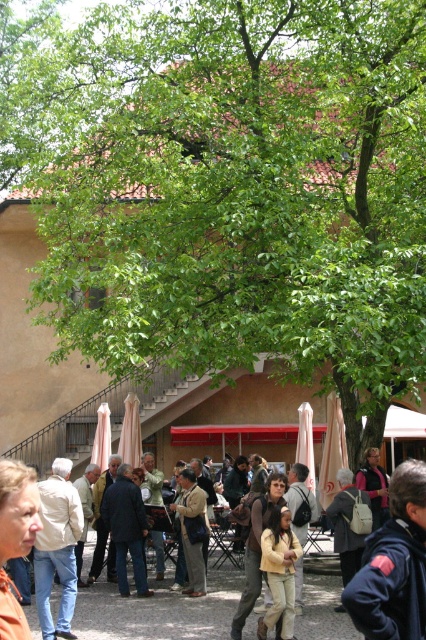
You are standing at the center of the courtyard and see the brown leather jacket at lower left. Which direction should you move to get closer to it?

Since the brown leather jacket at lower left is located at point (16, 538), you should move towards the lower left direction to get closer to it.

You are standing in the courtyard and want to place a small bench between the two points, point (46, 540) and point (123, 468). Which point should the bench be closer to in order to be nearer to the tree canopy?

The bench should be placed closer to point (46, 540) because it is closer to the viewer, meaning it would be positioned under the tree canopy where the people are gathered.